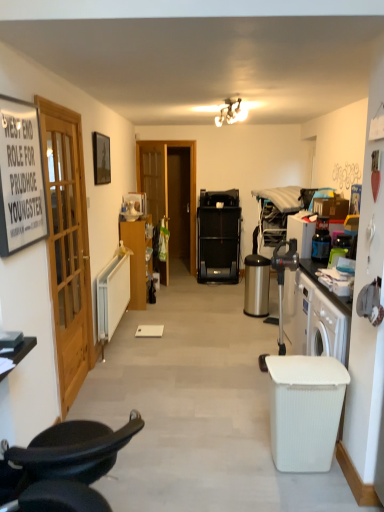
Question: Considering the relative sizes of white ribbed plastic trash bin/can at lower right, which is counted as the first trash bin/can, starting from the bottom, and matte black picture frame at upper left, acting as the 2th picture frame starting from the front, in the image provided, is white ribbed plastic trash bin/can at lower right, which is counted as the first trash bin/can, starting from the bottom, smaller than matte black picture frame at upper left, acting as the 2th picture frame starting from the front,?

Choices:
 (A) no
 (B) yes

Answer: (A)

Question: Does white ribbed plastic trash bin/can at lower right, which appears as the second trash bin/can when viewed from the top, come in front of matte black picture frame at upper left, which is the first picture frame from back to front?

Choices:
 (A) no
 (B) yes

Answer: (B)

Question: Is white ribbed plastic trash bin/can at lower right, which is counted as the first trash bin/can, starting from the bottom, looking in the opposite direction of matte black picture frame at upper left, acting as the 2th picture frame starting from the front?

Choices:
 (A) no
 (B) yes

Answer: (A)

Question: Is white ribbed plastic trash bin/can at lower right, which appears as the second trash bin/can when viewed from the top, at the right side of matte black picture frame at upper left, which is the first picture frame from back to front?

Choices:
 (A) yes
 (B) no

Answer: (A)

Question: Is white ribbed plastic trash bin/can at lower right, which appears as the second trash bin/can when viewed from the top, next to matte black picture frame at upper left, which is the first picture frame from back to front, and touching it?

Choices:
 (A) no
 (B) yes

Answer: (A)

Question: Would you say black leather chair at lower left is to the left or to the right of matte white light fixture at upper center in the picture?

Choices:
 (A) right
 (B) left

Answer: (B)

Question: Is black leather chair at lower left spatially inside matte white light fixture at upper center, or outside of it?

Choices:
 (A) inside
 (B) outside

Answer: (B)

Question: From a real-world perspective, is black leather chair at lower left above or below matte white light fixture at upper center?

Choices:
 (A) above
 (B) below

Answer: (B)

Question: Is black leather chair at lower left in front of or behind matte white light fixture at upper center in the image?

Choices:
 (A) behind
 (B) front

Answer: (B)

Question: Based on their positions, is matte wood cabinet at left located to the left or right of matte white light fixture at upper center?

Choices:
 (A) right
 (B) left

Answer: (B)

Question: From the image's perspective, is matte wood cabinet at left positioned above or below matte white light fixture at upper center?

Choices:
 (A) below
 (B) above

Answer: (A)

Question: Is matte wood cabinet at left bigger or smaller than matte white light fixture at upper center?

Choices:
 (A) small
 (B) big

Answer: (B)

Question: From a real-world perspective, relative to matte white light fixture at upper center, is matte wood cabinet at left vertically above or below?

Choices:
 (A) below
 (B) above

Answer: (A)

Question: In terms of width, does black paper sign at left, arranged as the 1th picture frame when viewed from the front, look wider or thinner when compared to matte wood cabinet at left?

Choices:
 (A) wide
 (B) thin

Answer: (B)

Question: Considering the positions of black paper sign at left, arranged as the 1th picture frame when viewed from the front, and matte wood cabinet at left in the image, is black paper sign at left, arranged as the 1th picture frame when viewed from the front, bigger or smaller than matte wood cabinet at left?

Choices:
 (A) big
 (B) small

Answer: (B)